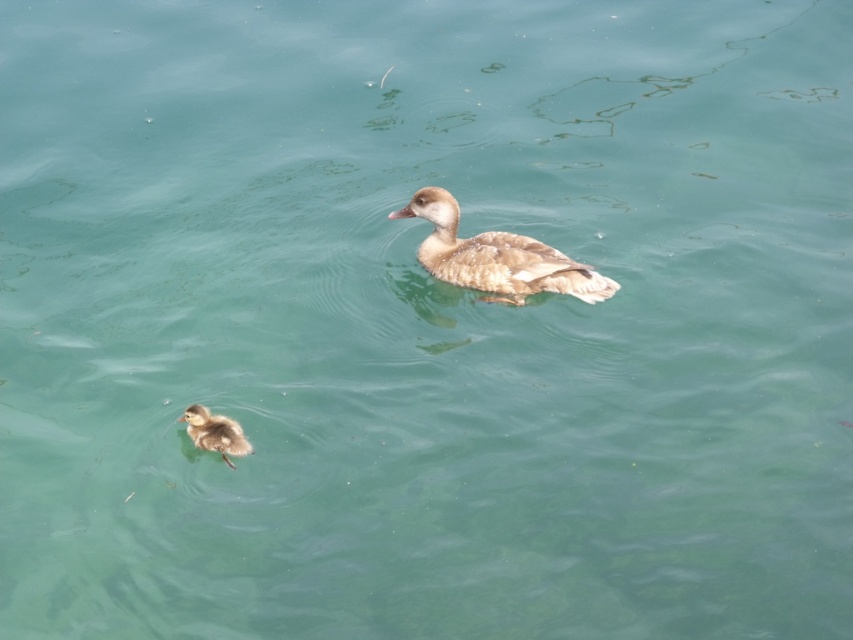
Question: Among these objects, which one is farthest from the camera?

Choices:
 (A) brown fluffy duckling at lower left
 (B) brown fuzzy duckling at center

Answer: (B)

Question: Among these objects, which one is farthest from the camera?

Choices:
 (A) brown fuzzy duckling at center
 (B) brown fluffy duckling at lower left

Answer: (A)

Question: Can you confirm if brown fuzzy duckling at center is thinner than brown fluffy duckling at lower left?

Choices:
 (A) no
 (B) yes

Answer: (A)

Question: Can you confirm if brown fuzzy duckling at center is positioned to the left of brown fluffy duckling at lower left?

Choices:
 (A) yes
 (B) no

Answer: (B)

Question: Among these points, which one is nearest to the camera?

Choices:
 (A) (231, 424)
 (B) (524, 289)

Answer: (A)

Question: Is brown fuzzy duckling at center to the right of brown fluffy duckling at lower left from the viewer's perspective?

Choices:
 (A) yes
 (B) no

Answer: (A)